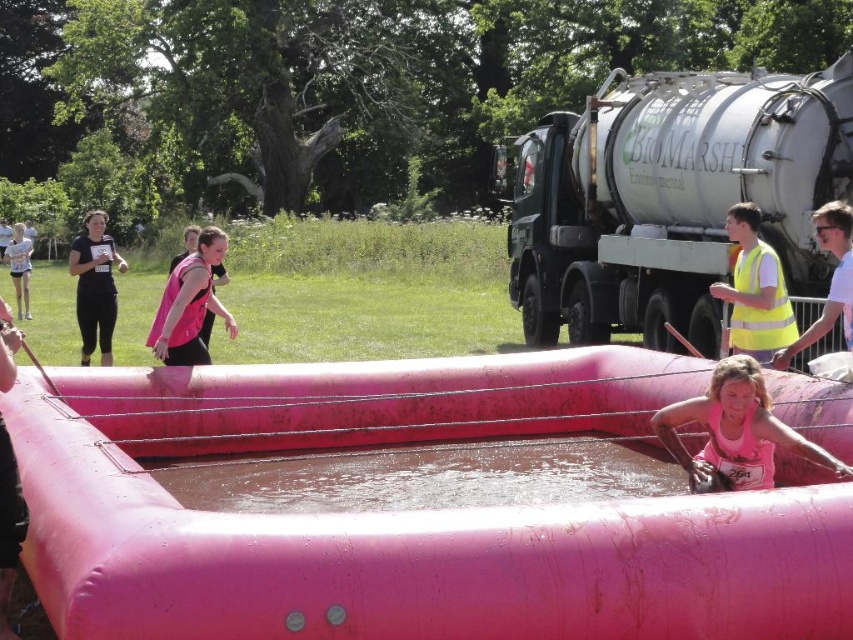
Question: Among these points, which one is nearest to the camera?

Choices:
 (A) (722, 376)
 (B) (79, 288)
 (C) (735, 317)
 (D) (51, 536)

Answer: (D)

Question: Which point is closer to the camera taking this photo?

Choices:
 (A) (231, 316)
 (B) (202, 264)

Answer: (B)

Question: In this image, where is clear plastic water at center located relative to pink fabric vest at center?

Choices:
 (A) right
 (B) left

Answer: (A)

Question: Is clear plastic water at center closer to camera compared to pink fabric vest at center?

Choices:
 (A) no
 (B) yes

Answer: (B)

Question: Is matte black tank top at left above pink matte safety vest at center?

Choices:
 (A) yes
 (B) no

Answer: (A)

Question: Considering the real-world distances, which object is farthest from the yellow reflective vest at right?

Choices:
 (A) pink fabric vest at center
 (B) pink rubber raft at center
 (C) matte black tank top at left
 (D) pink matte safety vest at center

Answer: (C)